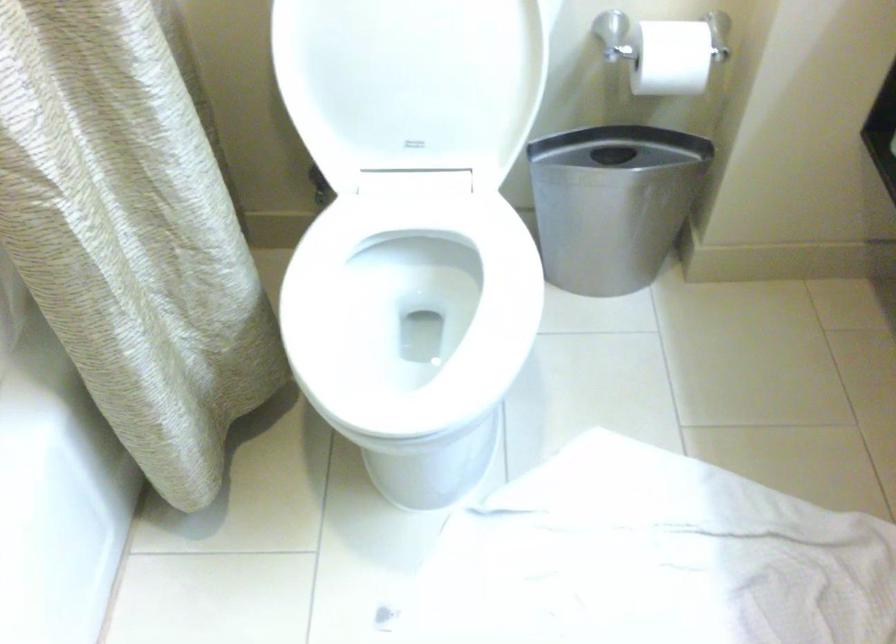
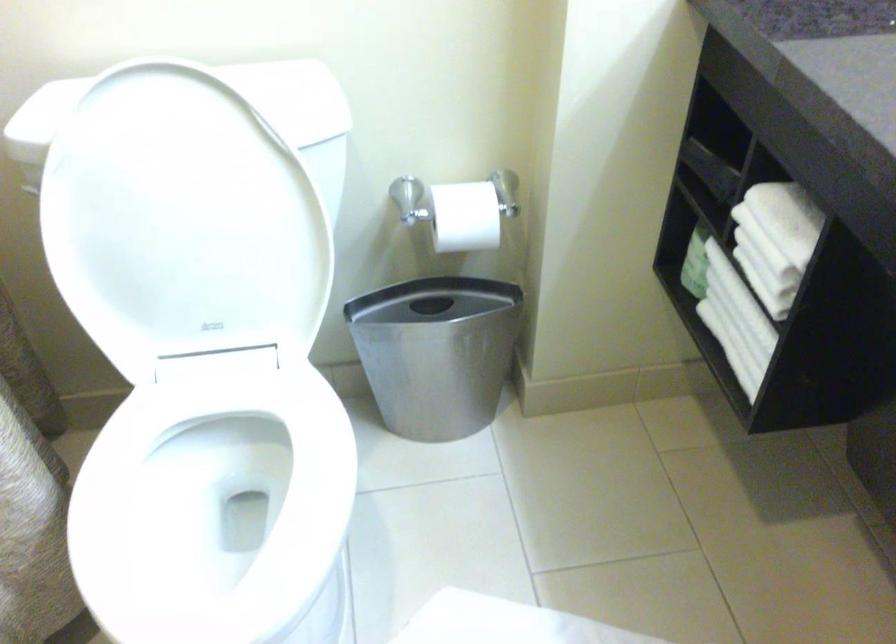
Question: Based on the continuous images, in which direction is the camera rotating? Reply with the corresponding letter.

Choices:
 (A) Left
 (B) Right
 (C) Up
 (D) Down

Answer: (B)